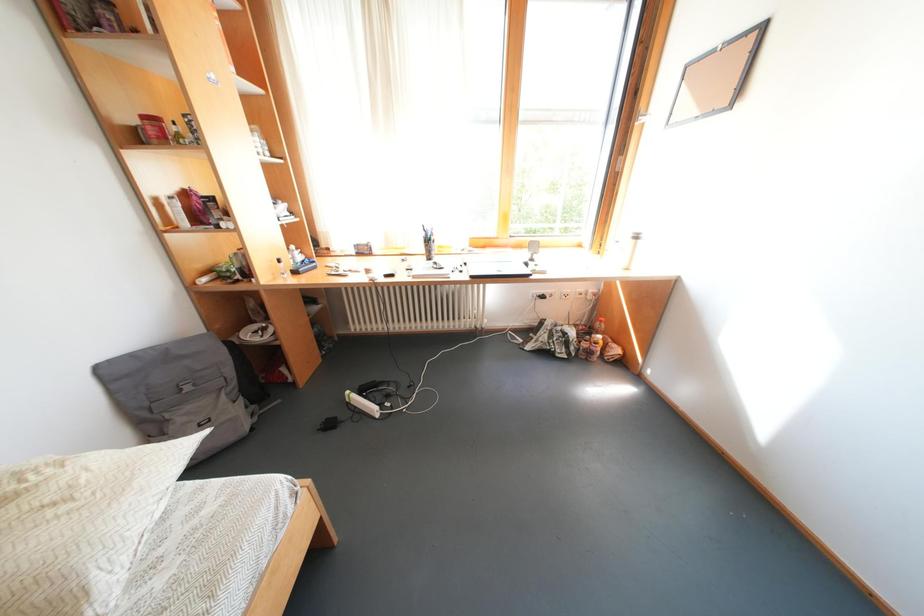
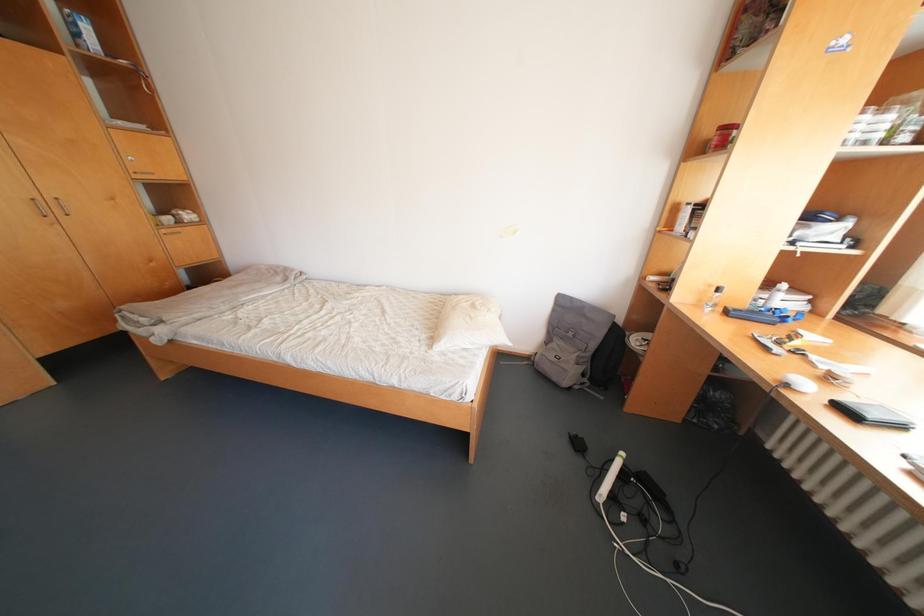
How did the camera likely rotate?

The camera rotated toward left-down.